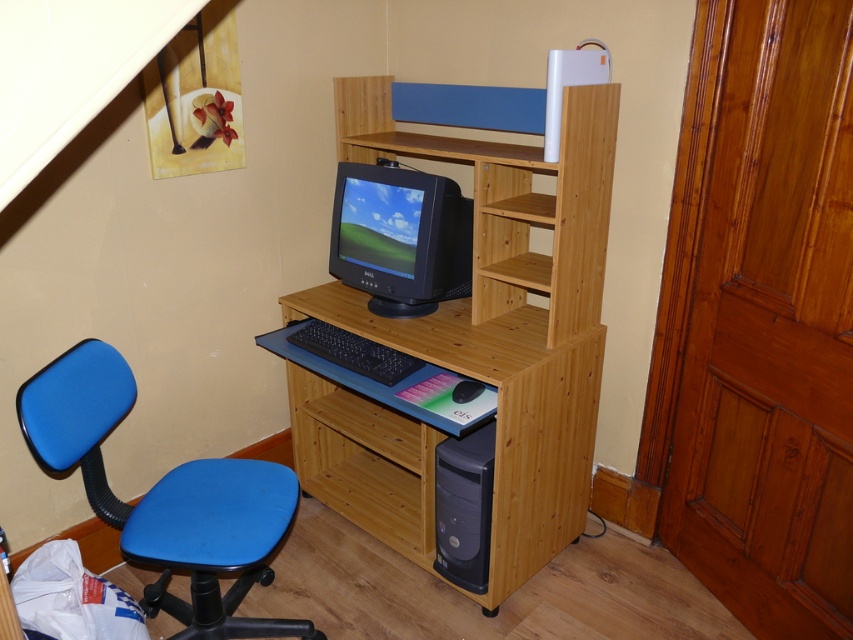
You are organizing your home office and want to place a new plant pot that is 12 inches tall. You have two options for placement either on the natural wood shelf at center or the black plastic computer at lower right. Based on their heights, which location can safely accommodate the plant pot without it being too tall?

The natural wood shelf at center is taller than the black plastic computer at lower right, so the plant pot can be placed on the natural wood shelf at center since it has sufficient height clearance.

You are setting up a new speaker for your desk. The speaker requires 10 inches of space to fit. Based on the scene, can the space between the natural wood shelf at center and matte black monitor at center accommodate the speaker?

The space between the natural wood shelf at center and matte black monitor at center is only 8.90 inches, which is less than the required 10 inches. Therefore, the speaker will not fit in that space.

You are organizing your home office and need to place a new item on the highest available surface. Given the natural wood shelf at center and the black plastic computer at lower right, which surface should you choose?

The natural wood shelf at center is located above the black plastic computer at lower right, so it is the higher surface and the best choice for placing the new item.